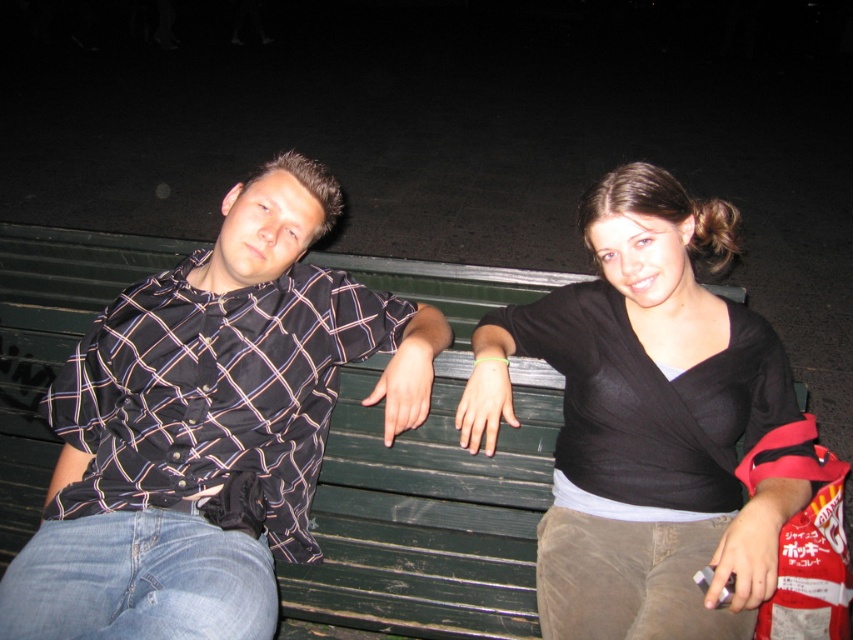
Between matte black shirt at left and black matte shirt at center, which one is positioned lower?

matte black shirt at left

Does matte black shirt at left have a greater height compared to black matte shirt at center?

No.

Who is more forward, (x=125, y=365) or (x=770, y=576)?

Point (x=770, y=576) is more forward.

Identify the location of matte black shirt at left. This screenshot has width=853, height=640. (209, 426).